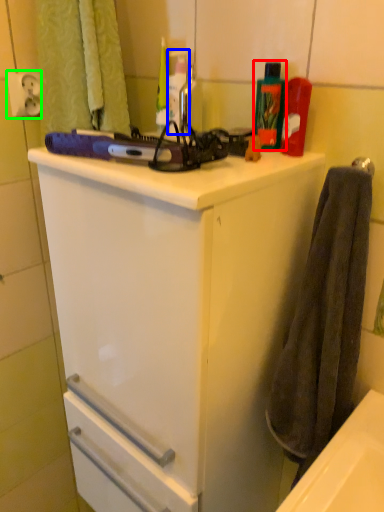
Question: Considering the real-world distances, which object is farthest from cleaning product (highlighted by a red box)? bottle (highlighted by a blue box) or electric outlet (highlighted by a green box)?

Choices:
 (A) bottle
 (B) electric outlet

Answer: (B)